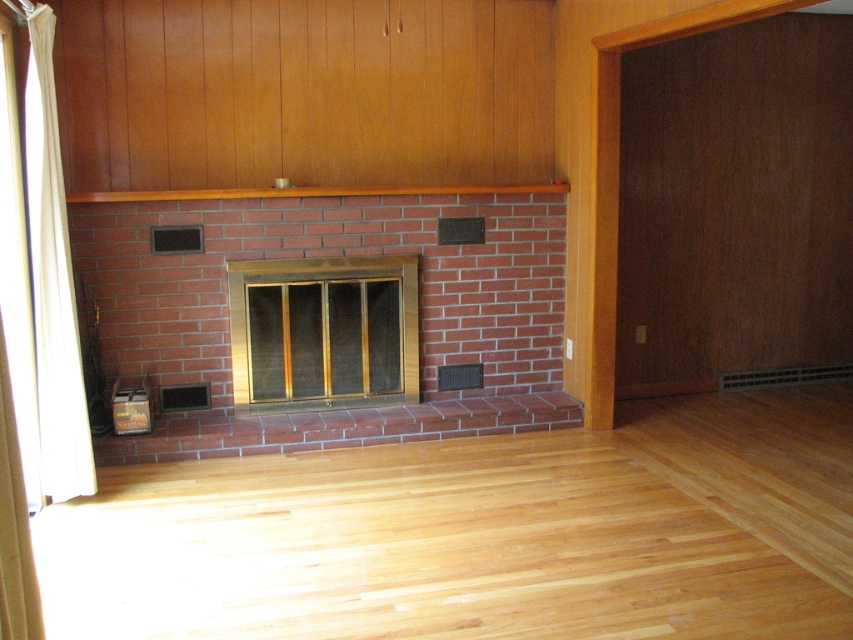
Which of these two, red brick fireplace at center or brown wood mantle at upper center, stands shorter?

brown wood mantle at upper center

The width and height of the screenshot is (853, 640). Describe the element at coordinates (325, 256) in the screenshot. I see `red brick fireplace at center` at that location.

You are a GUI agent. You are given a task and a screenshot of the screen. Output one action in this format:
    pyautogui.click(x=<x>, y=<y>)
    Task: Click on the red brick fireplace at center
    
    Given the screenshot: What is the action you would take?
    pyautogui.click(x=325, y=256)

Does white fabric curtain at left have a greater width compared to brown wood mantle at upper center?

No, white fabric curtain at left is not wider than brown wood mantle at upper center.

Does white fabric curtain at left lie in front of brown wood mantle at upper center?

Yes, it is in front of brown wood mantle at upper center.

Between point (70, 317) and point (267, 193), which one is positioned behind?

Point (267, 193)

I want to click on white fabric curtain at left, so click(51, 284).

What do you see at coordinates (325, 256) in the screenshot? The height and width of the screenshot is (640, 853). I see `red brick fireplace at center` at bounding box center [325, 256].

Is red brick fireplace at center positioned at the back of white fabric curtain at left?

Yes, it is behind white fabric curtain at left.

Who is more distant from viewer, (x=453, y=212) or (x=74, y=422)?

Point (x=453, y=212)

You are a GUI agent. You are given a task and a screenshot of the screen. Output one action in this format:
    pyautogui.click(x=<x>, y=<y>)
    Task: Click on the red brick fireplace at center
    
    Given the screenshot: What is the action you would take?
    pyautogui.click(x=325, y=256)